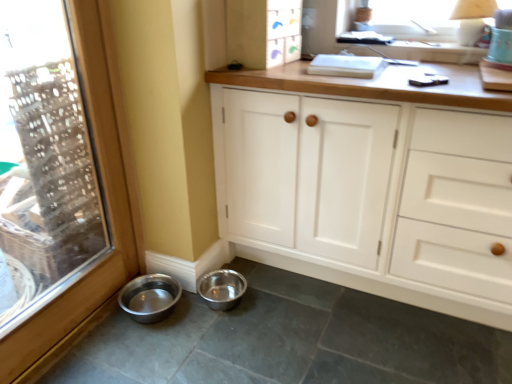
Question: Considering the relative sizes of white wood cabinet at upper center, positioned as the second cabinetry in bottom-to-top order, and metallic silver bowl at lower left, acting as the second basin starting from the left, in the image provided, is white wood cabinet at upper center, positioned as the second cabinetry in bottom-to-top order, taller than metallic silver bowl at lower left, acting as the second basin starting from the left,?

Choices:
 (A) yes
 (B) no

Answer: (A)

Question: Is white wood cabinet at upper center, which ranks as the 1th cabinetry in top-to-bottom order, oriented towards metallic silver bowl at lower left, the first basin in the right-to-left sequence?

Choices:
 (A) no
 (B) yes

Answer: (A)

Question: Is the surface of white wood cabinet at upper center, which ranks as the 1th cabinetry in top-to-bottom order, in direct contact with metallic silver bowl at lower left, acting as the second basin starting from the left?

Choices:
 (A) yes
 (B) no

Answer: (B)

Question: From the image's perspective, is white wood cabinet at upper center, positioned as the second cabinetry in bottom-to-top order, located above metallic silver bowl at lower left, the first basin in the right-to-left sequence?

Choices:
 (A) no
 (B) yes

Answer: (B)

Question: Considering the relative positions of white wood cabinet at upper center, positioned as the second cabinetry in bottom-to-top order, and metallic silver bowl at lower left, acting as the second basin starting from the left, in the image provided, is white wood cabinet at upper center, positioned as the second cabinetry in bottom-to-top order, to the right of metallic silver bowl at lower left, acting as the second basin starting from the left, from the viewer's perspective?

Choices:
 (A) yes
 (B) no

Answer: (A)

Question: Can you confirm if white wood cabinet at upper center, which ranks as the 1th cabinetry in top-to-bottom order, is wider than metallic silver bowl at lower left, acting as the second basin starting from the left?

Choices:
 (A) yes
 (B) no

Answer: (B)

Question: Can we say transparent glass window at left lies outside white wood cabinet at center, the second cabinetry from the top?

Choices:
 (A) no
 (B) yes

Answer: (B)

Question: Does transparent glass window at left appear on the left side of white wood cabinet at center, the 1th cabinetry from the bottom?

Choices:
 (A) no
 (B) yes

Answer: (B)

Question: Considering the relative sizes of transparent glass window at left and white wood cabinet at center, the second cabinetry from the top, in the image provided, is transparent glass window at left wider than white wood cabinet at center, the second cabinetry from the top,?

Choices:
 (A) no
 (B) yes

Answer: (A)

Question: Is transparent glass window at left next to white wood cabinet at center, the second cabinetry from the top?

Choices:
 (A) yes
 (B) no

Answer: (B)

Question: Considering the relative sizes of transparent glass window at left and white wood cabinet at center, the second cabinetry from the top, in the image provided, is transparent glass window at left smaller than white wood cabinet at center, the second cabinetry from the top,?

Choices:
 (A) yes
 (B) no

Answer: (A)

Question: From a real-world perspective, is transparent glass window at left over white wood cabinet at center, the 1th cabinetry from the bottom?

Choices:
 (A) yes
 (B) no

Answer: (A)

Question: Can you confirm if white wood cabinet at upper center, which ranks as the 1th cabinetry in top-to-bottom order, is shorter than metallic silver bowl at lower left, which is counted as the first basin, starting from the left?

Choices:
 (A) no
 (B) yes

Answer: (A)